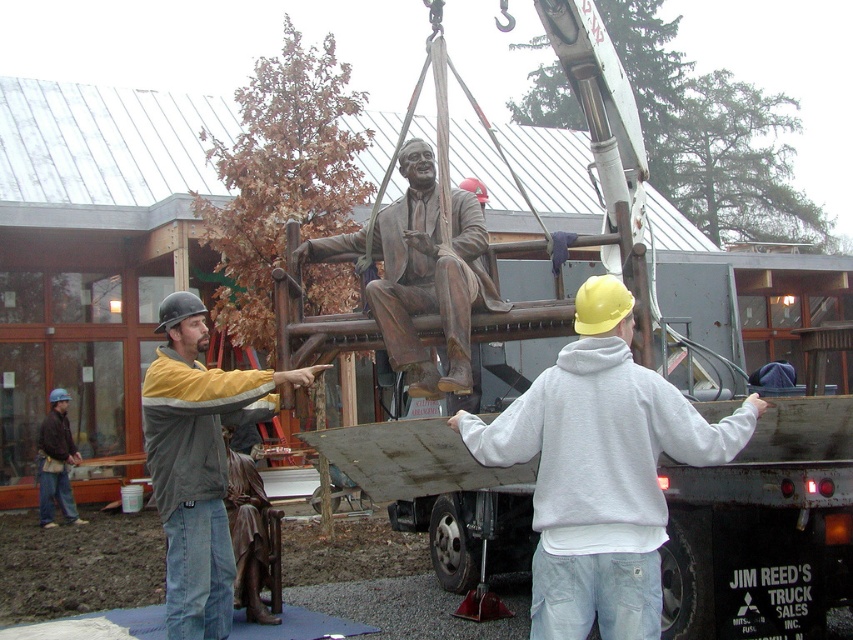
Question: Which object is positioned closest to the brushed bronze statue at center?

Choices:
 (A) brushed metal hard hat at lower left
 (B) bronze statue at center
 (C) white matte hoodie at center

Answer: (B)

Question: Which object is positioned farthest from the white matte hoodie at center?

Choices:
 (A) bronze statue at center
 (B) brushed metal hard hat at lower left

Answer: (B)

Question: Is brushed bronze statue at center thinner than brushed metal hard hat at lower left?

Choices:
 (A) yes
 (B) no

Answer: (B)

Question: Does white matte hoodie at center appear under brushed bronze statue at center?

Choices:
 (A) yes
 (B) no

Answer: (B)

Question: Which point appears farthest from the camera in this image?

Choices:
 (A) (161, 435)
 (B) (311, 244)
 (C) (532, 525)

Answer: (B)

Question: In this image, where is white matte hoodie at center located relative to brushed bronze statue at center?

Choices:
 (A) below
 (B) above

Answer: (B)